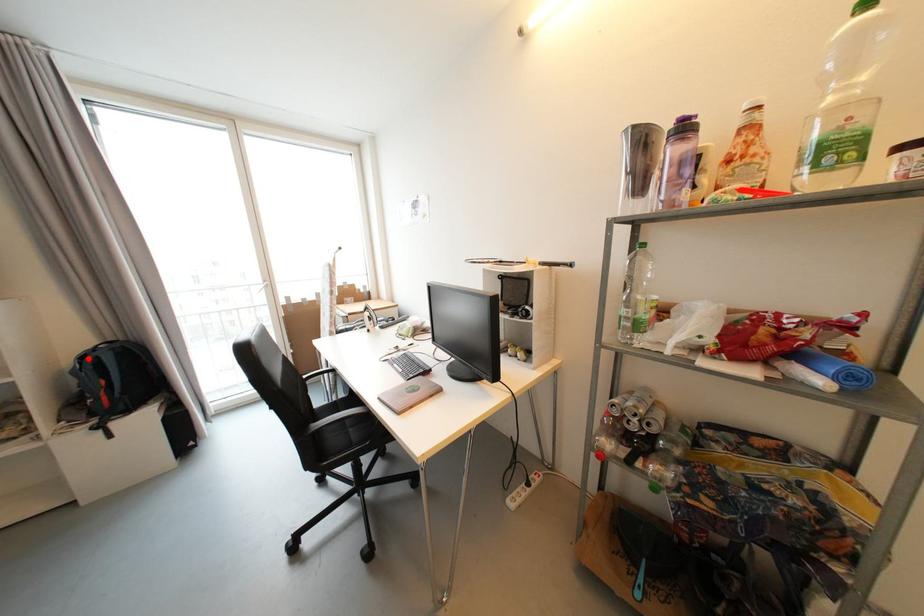
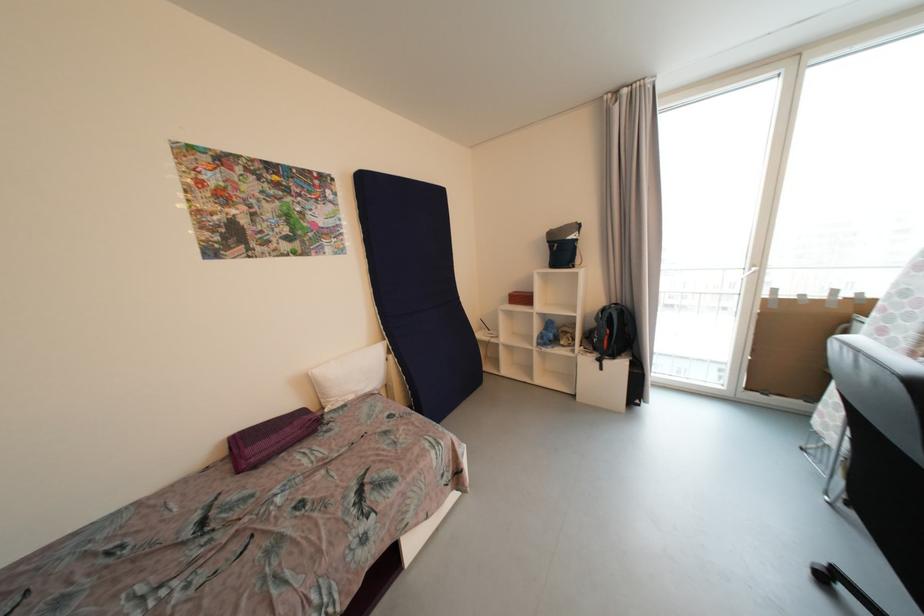
Find the pixel in the second image that matches the highlighted location in the first image.

(608, 312)